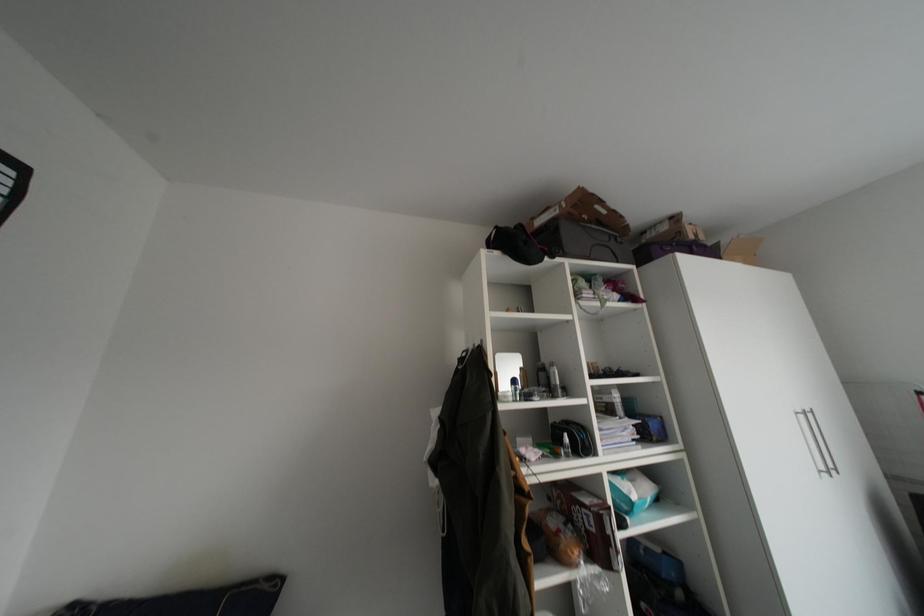
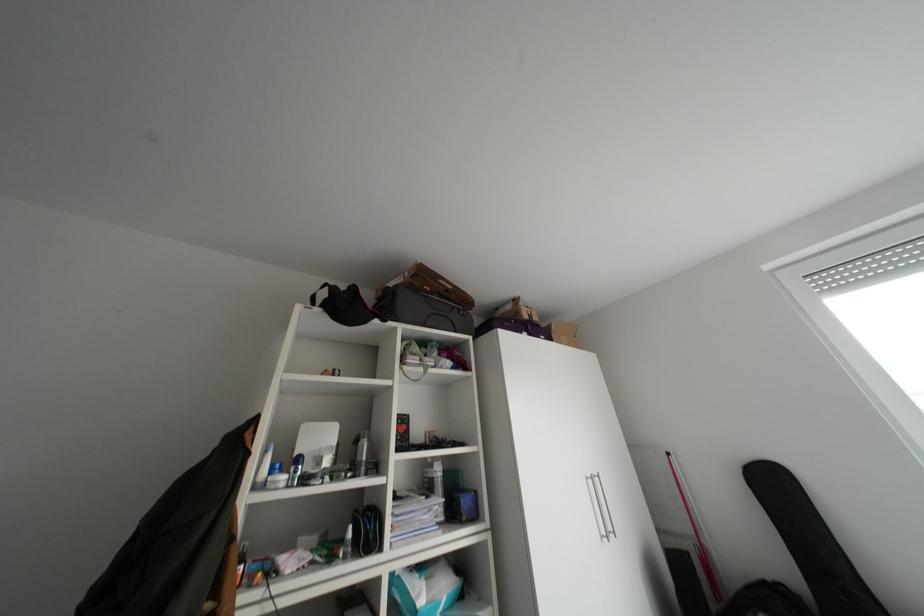
Question: How did the camera likely rotate?

Choices:
 (A) Left
 (B) Right
 (C) Up
 (D) Down

Answer: (B)